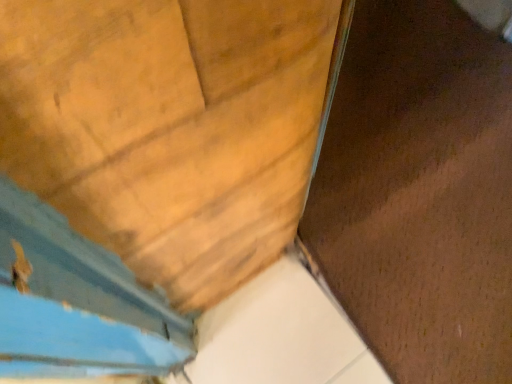
Question: Is wooden door at center surrounded by brown matte plywood at center?

Choices:
 (A) yes
 (B) no

Answer: (B)

Question: Is brown matte plywood at center thinner than wooden door at center?

Choices:
 (A) no
 (B) yes

Answer: (A)

Question: Is brown matte plywood at center positioned in front of wooden door at center?

Choices:
 (A) no
 (B) yes

Answer: (A)

Question: Does brown matte plywood at center have a smaller size compared to wooden door at center?

Choices:
 (A) yes
 (B) no

Answer: (B)

Question: Is brown matte plywood at center outside of wooden door at center?

Choices:
 (A) no
 (B) yes

Answer: (B)

Question: Does brown matte plywood at center have a larger size compared to wooden door at center?

Choices:
 (A) yes
 (B) no

Answer: (A)

Question: Is wooden door at center completely or partially outside of brown matte plywood at center?

Choices:
 (A) yes
 (B) no

Answer: (A)

Question: Is wooden door at center bigger than brown matte plywood at center?

Choices:
 (A) no
 (B) yes

Answer: (A)

Question: Considering the relative positions of wooden door at center and brown matte plywood at center in the image provided, is wooden door at center in front of brown matte plywood at center?

Choices:
 (A) no
 (B) yes

Answer: (B)

Question: Would you consider wooden door at center to be distant from brown matte plywood at center?

Choices:
 (A) no
 (B) yes

Answer: (A)

Question: Does wooden door at center have a lesser height compared to brown matte plywood at center?

Choices:
 (A) no
 (B) yes

Answer: (A)

Question: Does wooden door at center lie behind brown matte plywood at center?

Choices:
 (A) yes
 (B) no

Answer: (B)

Question: In terms of size, does wooden door at center appear bigger or smaller than brown matte plywood at center?

Choices:
 (A) big
 (B) small

Answer: (B)